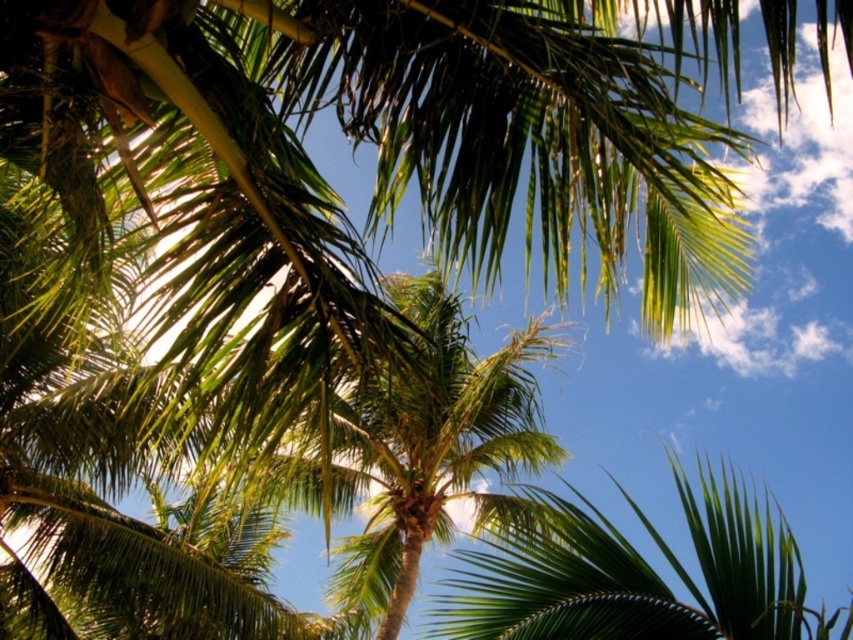
Question: In this image, where is green leafy palm tree at center located relative to green leafy palm at center?

Choices:
 (A) left
 (B) right

Answer: (A)

Question: Where is green leafy palm tree at center located in relation to green leafy palm at center in the image?

Choices:
 (A) right
 (B) left

Answer: (B)

Question: Among these objects, which one is nearest to the camera?

Choices:
 (A) green leafy palm tree at center
 (B) green leafy palm at center

Answer: (A)

Question: Does green leafy palm tree at center have a smaller size compared to green leafy palm at center?

Choices:
 (A) yes
 (B) no

Answer: (B)

Question: Which object appears closest to the camera in this image?

Choices:
 (A) green leafy palm tree at center
 (B) green leafy palm at center

Answer: (A)